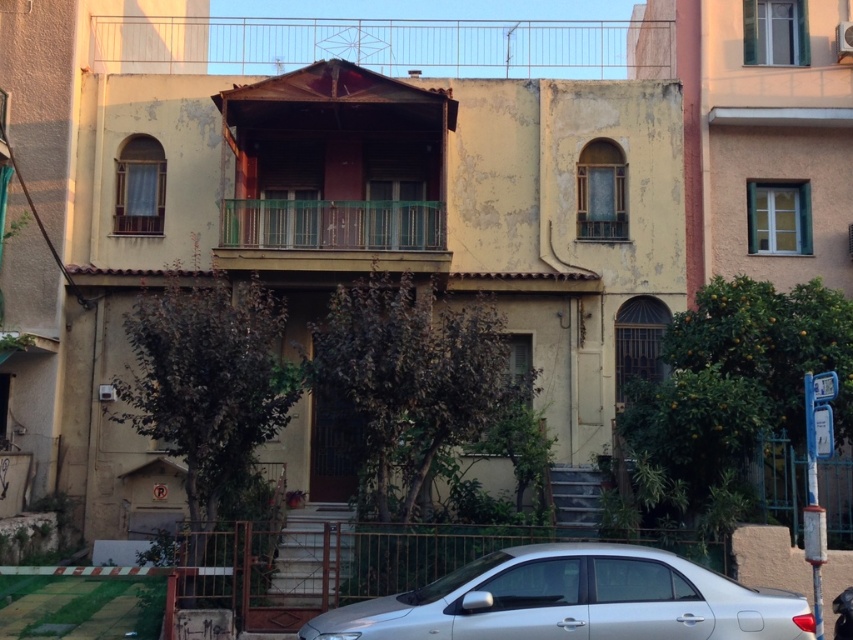
You are a delivery person trying to park your 1.5 meter tall delivery robot in the space where the silver metallic car at lower center is currently parked. Based on the scene, will the robot fit vertically in that space without hitting the rustic wood balcony at upper center?

The silver metallic car at lower center has a lesser height compared to rustic wood balcony at upper center. Since the robot is 1.5 meters tall, and the car is shorter than the balcony, the robot should fit vertically as long as its height does not exceed the balcony height. However, since the car is already parked there and is shorter, the space likely allows the robot to fit without hitting the balcony.

You are a window washer standing on the ground in front of the residential building. You need to clean both the rustic wood balcony at upper center and the green glass railing at center. Which object should you clean first if you want to start with the one closer to the street?

The green glass railing at center should be cleaned first because the rustic wood balcony at upper center is positioned to its right, meaning it is further away from the street compared to the green glass railing at center.

You are standing at the entrance of the residential building and want to park your car in the parking spot marked by point (573,600). Is the parking spot available?

The parking spot marked by point (573,600) is currently occupied by a silver metallic car at lower center, so it is not available.